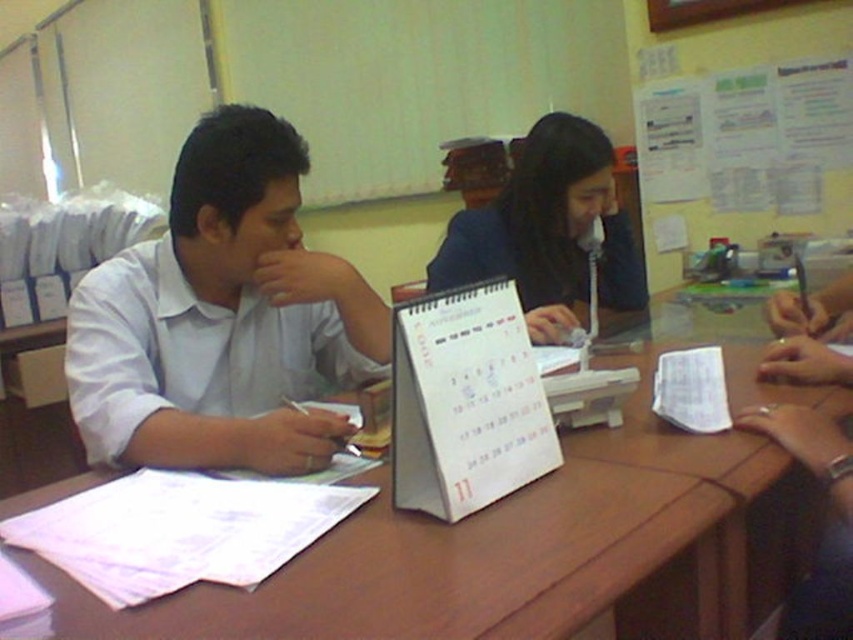
Question: Can you confirm if wooden table at center is positioned to the left of smooth brown wristwatch at lower right?

Choices:
 (A) no
 (B) yes

Answer: (B)

Question: Does white paper calendar at center appear on the left side of smooth brown wristwatch at lower right?

Choices:
 (A) yes
 (B) no

Answer: (A)

Question: Is white paper calendar at center to the left of black matte hair at center from the viewer's perspective?

Choices:
 (A) no
 (B) yes

Answer: (B)

Question: Which of the following is the closest to the observer?

Choices:
 (A) (469, 272)
 (B) (125, 410)
 (C) (722, 374)

Answer: (B)

Question: Which point is farther to the camera?

Choices:
 (A) white paperboard at upper right
 (B) wooden table at center

Answer: (A)

Question: Estimate the real-world distances between objects in this image. Which object is farther from the black matte hair at center?

Choices:
 (A) white shirt at left
 (B) smooth brown wristwatch at lower right
 (C) white paper calendar at center

Answer: (C)